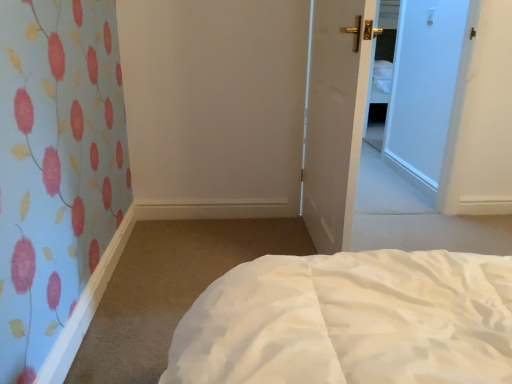
This screenshot has width=512, height=384. What do you see at coordinates (351, 321) in the screenshot? I see `white soft bed at lower center` at bounding box center [351, 321].

The height and width of the screenshot is (384, 512). I want to click on white soft bed at lower center, so click(351, 321).

Find the location of a particular element. The image size is (512, 384). white matte door at center is located at coordinates (335, 119).

What do you see at coordinates (335, 119) in the screenshot?
I see `white matte door at center` at bounding box center [335, 119].

Identify the location of white soft bed at lower center. (351, 321).

Is white matte door at center at the right side of white soft bed at lower center?

No.

Does white matte door at center lie behind white soft bed at lower center?

Yes, it is behind white soft bed at lower center.

Which is in front, point (352, 52) or point (494, 309)?

The point (494, 309) is closer.

From the image's perspective, is white matte door at center located above white soft bed at lower center?

Yes, from the image's perspective, white matte door at center is over white soft bed at lower center.

From a real-world perspective, who is located higher, white matte door at center or white soft bed at lower center?

In real-world perspective, white matte door at center is above.

Considering the relative sizes of white matte door at center and white soft bed at lower center in the image provided, is white matte door at center thinner than white soft bed at lower center?

Yes, white matte door at center is thinner than white soft bed at lower center.

Is white matte door at center shorter than white soft bed at lower center?

In fact, white matte door at center may be taller than white soft bed at lower center.

Considering the relative sizes of white matte door at center and white soft bed at lower center in the image provided, is white matte door at center bigger than white soft bed at lower center?

Yes, white matte door at center is bigger than white soft bed at lower center.

Is white matte door at center spatially inside white soft bed at lower center, or outside of it?

white matte door at center is outside white soft bed at lower center.

Is white matte door at center positioned far away from white soft bed at lower center?

No, white matte door at center is not far from white soft bed at lower center.

Is white soft bed at lower center at the back of white matte door at center?

No, white matte door at center's orientation is not away from white soft bed at lower center.

How many degrees apart are the facing directions of white matte door at center and white soft bed at lower center?

There is a 90.8-degree angle between the facing directions of white matte door at center and white soft bed at lower center.

You are a GUI agent. You are given a task and a screenshot of the screen. Output one action in this format:
    pyautogui.click(x=<x>, y=<y>)
    Task: Click on the door positioned vertically above the white soft bed at lower center (from a real-world perspective)
    
    Given the screenshot: What is the action you would take?
    pyautogui.click(x=335, y=119)

Is white soft bed at lower center to the left of white matte door at center from the viewer's perspective?

No.

Is the depth of white soft bed at lower center greater than that of white matte door at center?

No, white soft bed at lower center is closer to the viewer.

Is point (432, 320) farther from viewer compared to point (322, 137)?

That is False.

From the image's perspective, is white soft bed at lower center located above or below white matte door at center?

white soft bed at lower center is situated lower than white matte door at center in the image.

From a real-world perspective, is white soft bed at lower center positioned over white matte door at center based on gravity?

No, from a real-world perspective, white soft bed at lower center is not above white matte door at center.

Considering the sizes of objects white soft bed at lower center and white matte door at center in the image provided, who is thinner, white soft bed at lower center or white matte door at center?

With smaller width is white matte door at center.

Looking at this image, considering the relative sizes of white soft bed at lower center and white matte door at center in the image provided, is white soft bed at lower center shorter than white matte door at center?

Yes, white soft bed at lower center is shorter than white matte door at center.

Which of these two, white soft bed at lower center or white matte door at center, is bigger?

white matte door at center.

Can white matte door at center be found inside white soft bed at lower center?

Definitely not — white matte door at center is not inside white soft bed at lower center.

Is white soft bed at lower center far from white matte door at center?

white soft bed at lower center is near white matte door at center, not far away.

Is white matte door at center at the back of white soft bed at lower center?

That's not correct — white soft bed at lower center is not looking away from white matte door at center.

How many degrees apart are the facing directions of white soft bed at lower center and white matte door at center?

The angular difference between white soft bed at lower center and white matte door at center is 90.8 degrees.

How distant is white soft bed at lower center from white matte door at center?

white soft bed at lower center and white matte door at center are 38.21 inches apart.

Identify the location of door above the white soft bed at lower center (from the image's perspective). The height and width of the screenshot is (384, 512). (335, 119).

Find the location of a particular element. The height and width of the screenshot is (384, 512). bed below the white matte door at center (from the image's perspective) is located at coordinates (x=351, y=321).

Where is `bed on the right of white matte door at center`? The height and width of the screenshot is (384, 512). bed on the right of white matte door at center is located at coordinates (351, 321).